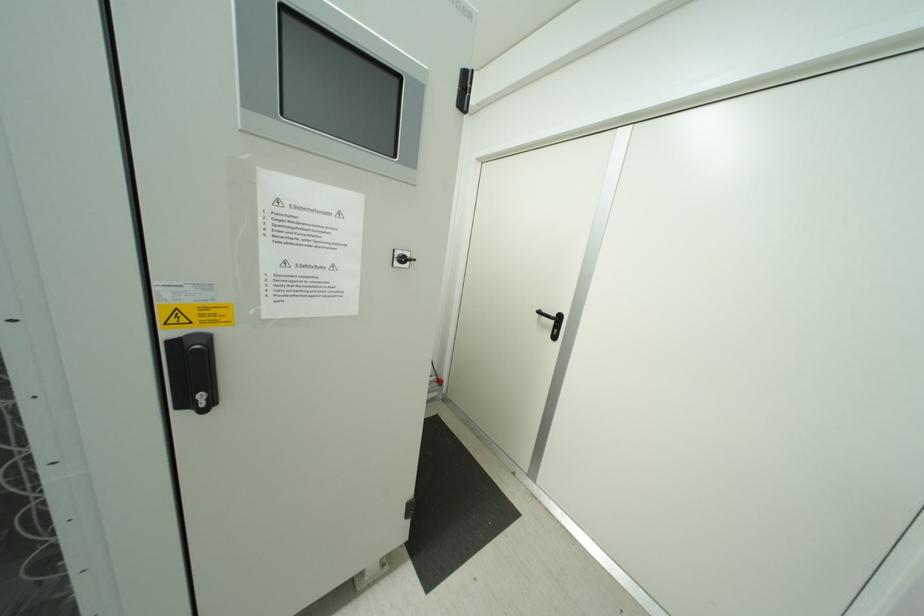
At what (x,y) coordinates should I click in order to perform the action: click on black door handle. Please return your answer as a coordinate pair (x, y). The image size is (924, 616). Looking at the image, I should click on (555, 326).